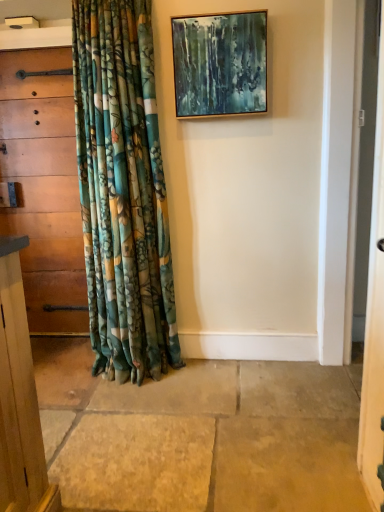
Question: Can you see wooden chest of drawers at left touching wooden picture frame at upper center?

Choices:
 (A) yes
 (B) no

Answer: (B)

Question: Would you say wooden picture frame at upper center is part of wooden chest of drawers at left's contents?

Choices:
 (A) yes
 (B) no

Answer: (B)

Question: Can you confirm if wooden chest of drawers at left is thinner than wooden picture frame at upper center?

Choices:
 (A) no
 (B) yes

Answer: (A)

Question: From the image's perspective, is wooden chest of drawers at left located above wooden picture frame at upper center?

Choices:
 (A) no
 (B) yes

Answer: (A)

Question: Could you tell me if wooden chest of drawers at left is turned towards wooden picture frame at upper center?

Choices:
 (A) no
 (B) yes

Answer: (A)

Question: Does wooden chest of drawers at left lie behind wooden picture frame at upper center?

Choices:
 (A) yes
 (B) no

Answer: (A)

Question: Does wooden picture frame at upper center appear on the left side of wooden chest of drawers at left?

Choices:
 (A) no
 (B) yes

Answer: (A)

Question: Does wooden picture frame at upper center have a lesser width compared to wooden chest of drawers at left?

Choices:
 (A) yes
 (B) no

Answer: (A)

Question: Is the position of wooden picture frame at upper center less distant than that of wooden chest of drawers at left?

Choices:
 (A) no
 (B) yes

Answer: (B)

Question: Can you confirm if wooden picture frame at upper center is shorter than wooden chest of drawers at left?

Choices:
 (A) yes
 (B) no

Answer: (A)

Question: From a real-world perspective, is wooden picture frame at upper center beneath wooden chest of drawers at left?

Choices:
 (A) no
 (B) yes

Answer: (A)

Question: Is wooden picture frame at upper center far away from wooden chest of drawers at left?

Choices:
 (A) yes
 (B) no

Answer: (A)

Question: In terms of height, does wooden picture frame at upper center look taller or shorter compared to wooden chest of drawers at left?

Choices:
 (A) tall
 (B) short

Answer: (B)